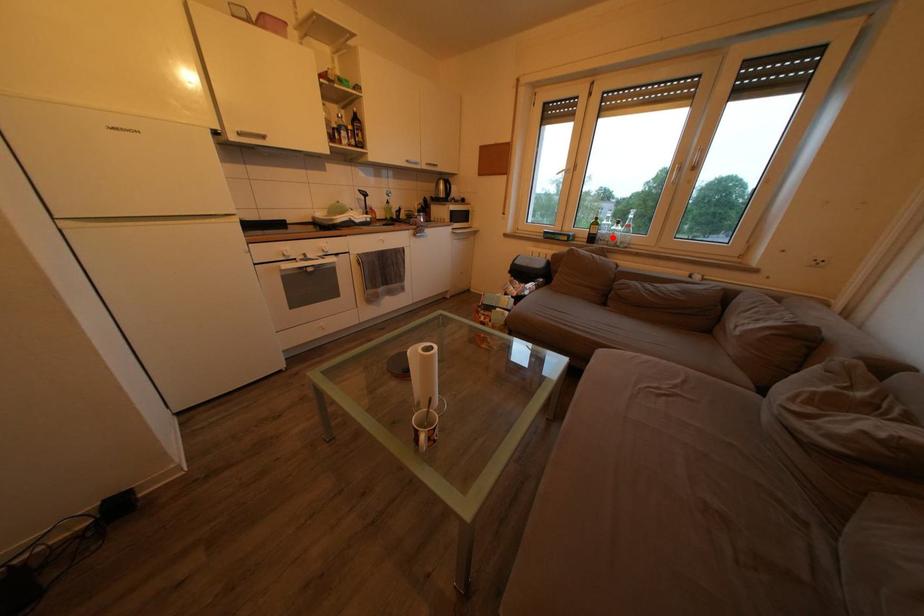
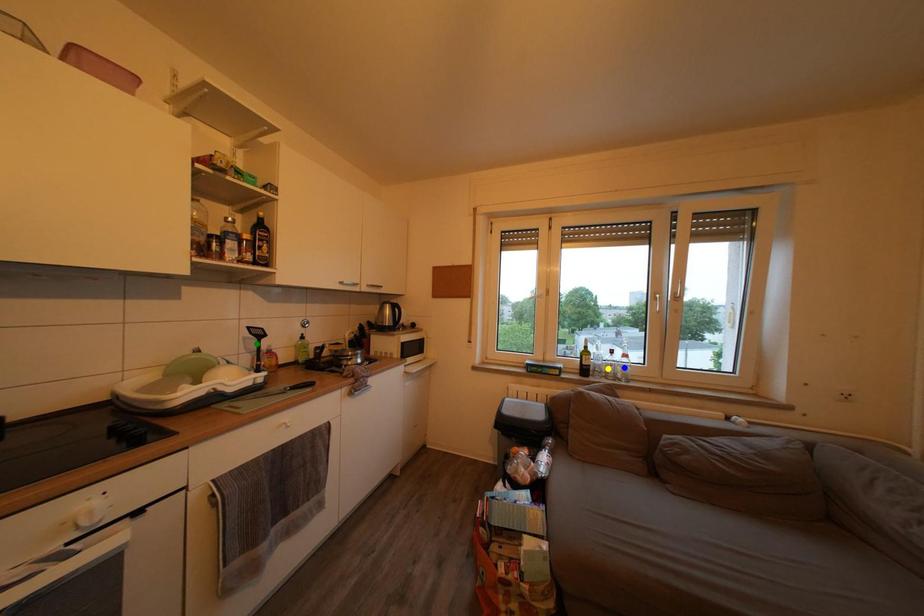
Question: I am providing you with two images of the same scene from different viewpoints. A red point is marked on the first image. You are given multiple points on the second image. In image 2, which mark is for the same physical point as the one in image 1?

Choices:
 (A) yellow point
 (B) blue point
 (C) green point

Answer: (A)